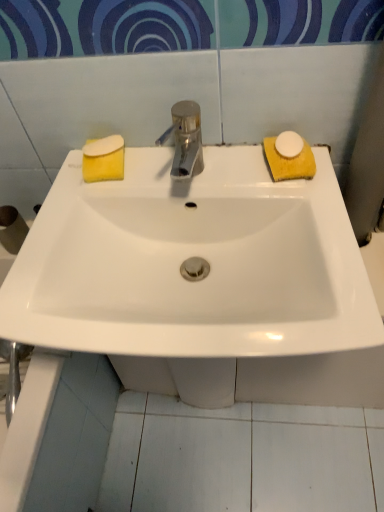
Locate an element on the screen. Image resolution: width=384 pixels, height=512 pixels. free space in front of white matte soap at right, the 1th soap from the right is located at coordinates (313, 211).